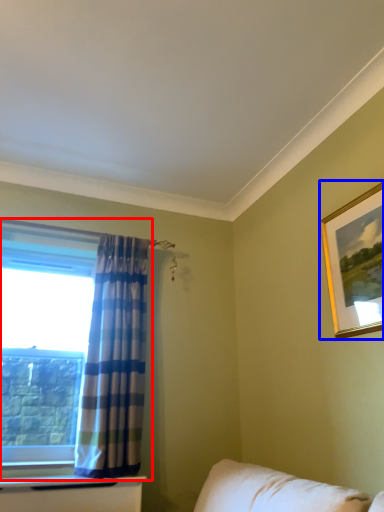
Question: Among these objects, which one is farthest to the camera, window (highlighted by a red box) or picture frame (highlighted by a blue box)?

Choices:
 (A) window
 (B) picture frame

Answer: (A)